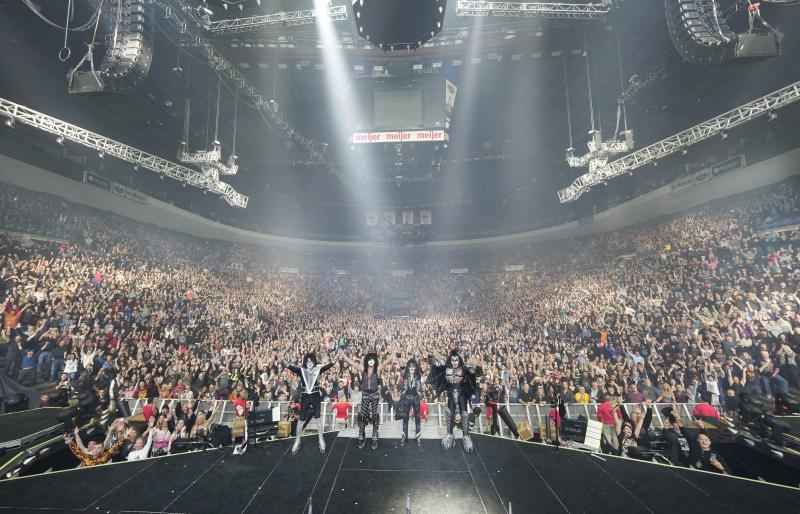
This screenshot has width=800, height=514. What are the coordinates of `stage` in the screenshot? It's located at (x=378, y=505).